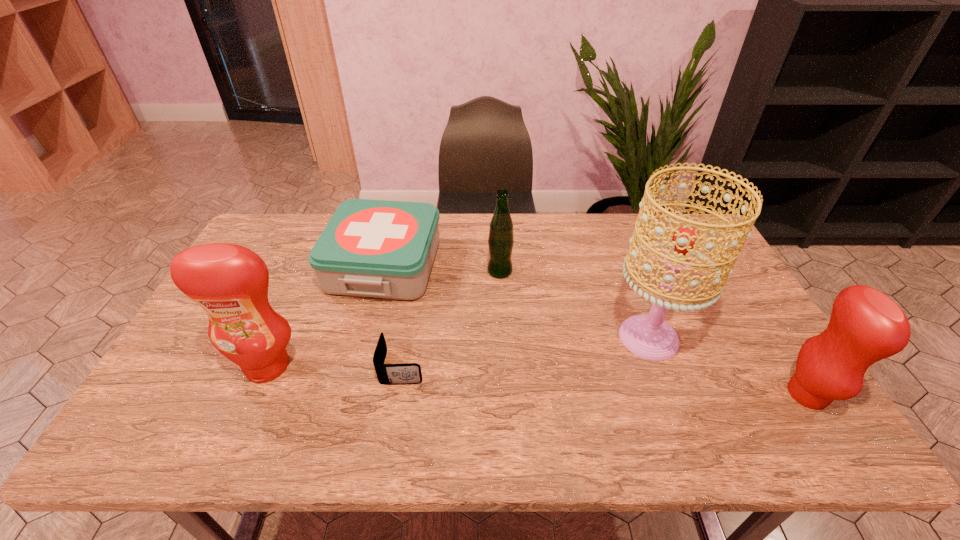
The image size is (960, 540). I want to click on the taller condiment, so click(x=230, y=282).

What are the coordinates of `the left condiment` in the screenshot? It's located at (230, 282).

Identify the location of the shorter condiment. (866, 326).

Identify the location of the right condiment. (866, 326).

At what (x,y) coordinates should I click in order to perform the action: click on the fifth object from left to right. Please return your answer as a coordinate pair (x, y). The image size is (960, 540). Looking at the image, I should click on (648, 336).

The height and width of the screenshot is (540, 960). In order to click on the tallest object in this screenshot , I will do `click(648, 336)`.

This screenshot has width=960, height=540. What are the coordinates of `the third object from right to left` in the screenshot? It's located at (501, 239).

At what (x,y) coordinates should I click in order to perform the action: click on the first-aid kit. Please return your answer as a coordinate pair (x, y). Looking at the image, I should click on (370, 248).

Identify the location of the shortest object. (388, 374).

In order to click on blank area located on the back of the second object from right to left in this screenshot , I will do `click(611, 235)`.